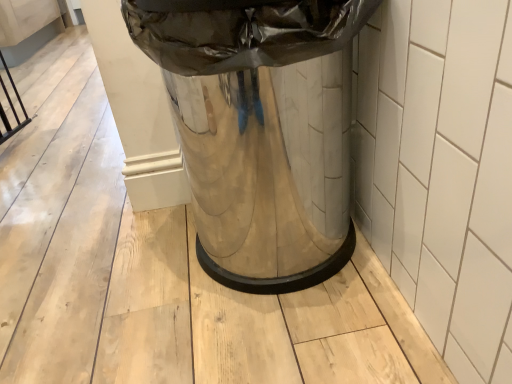
This screenshot has height=384, width=512. Find the location of `white glossy tile at right`. white glossy tile at right is located at coordinates (440, 170).

Describe the element at coordinates (440, 170) in the screenshot. This screenshot has height=384, width=512. I see `white glossy tile at right` at that location.

The height and width of the screenshot is (384, 512). Describe the element at coordinates (260, 130) in the screenshot. I see `polished metallic trash can at center` at that location.

This screenshot has height=384, width=512. In order to click on polished metallic trash can at center in this screenshot , I will do `click(260, 130)`.

Locate an element on the screen. white glossy tile at right is located at coordinates pos(440,170).

Is polished metallic trash can at center to the left of white glossy tile at right from the viewer's perspective?

Correct, you'll find polished metallic trash can at center to the left of white glossy tile at right.

Considering the positions of objects polished metallic trash can at center and white glossy tile at right in the image provided, who is in front, polished metallic trash can at center or white glossy tile at right?

white glossy tile at right.

Is point (231, 42) farther from camera compared to point (463, 245)?

Yes, it is.

From the image's perspective, is polished metallic trash can at center on top of white glossy tile at right?

Yes.

From a real-world perspective, is polished metallic trash can at center positioned above or below white glossy tile at right?

polished metallic trash can at center is above white glossy tile at right.

Considering the relative sizes of polished metallic trash can at center and white glossy tile at right in the image provided, is polished metallic trash can at center wider than white glossy tile at right?

Correct, the width of polished metallic trash can at center exceeds that of white glossy tile at right.

Who is taller, polished metallic trash can at center or white glossy tile at right?

Standing taller between the two is polished metallic trash can at center.

Who is bigger, polished metallic trash can at center or white glossy tile at right?

Bigger between the two is polished metallic trash can at center.

Would you say polished metallic trash can at center is inside or outside white glossy tile at right?

polished metallic trash can at center cannot be found inside white glossy tile at right.

Looking at this image, is polished metallic trash can at center not near white glossy tile at right?

polished metallic trash can at center is near white glossy tile at right, not far away.

Could you tell me if polished metallic trash can at center is facing white glossy tile at right?

No.

Can you tell me how much polished metallic trash can at center and white glossy tile at right differ in facing direction?

The angular difference between polished metallic trash can at center and white glossy tile at right is 89.5 degrees.

How distant is polished metallic trash can at center from white glossy tile at right?

polished metallic trash can at center and white glossy tile at right are 21.23 centimeters apart.

This screenshot has width=512, height=384. What are the coordinates of `waste container behind the white glossy tile at right` in the screenshot? It's located at (260, 130).

Between white glossy tile at right and polished metallic trash can at center, which one appears on the left side from the viewer's perspective?

Positioned to the left is polished metallic trash can at center.

Is white glossy tile at right further to camera compared to polished metallic trash can at center?

No, white glossy tile at right is closer to the camera.

Does point (443, 254) come behind point (279, 100)?

No.

From the image's perspective, would you say white glossy tile at right is shown under polished metallic trash can at center?

Correct, white glossy tile at right appears lower than polished metallic trash can at center in the image.

From a real-world perspective, which is physically below, white glossy tile at right or polished metallic trash can at center?

white glossy tile at right.

Which object is wider, white glossy tile at right or polished metallic trash can at center?

With larger width is polished metallic trash can at center.

Considering the sizes of objects white glossy tile at right and polished metallic trash can at center in the image provided, who is taller, white glossy tile at right or polished metallic trash can at center?

polished metallic trash can at center is taller.

Can you confirm if white glossy tile at right is smaller than polished metallic trash can at center?

Yes.

Is white glossy tile at right inside or outside of polished metallic trash can at center?

white glossy tile at right is not inside polished metallic trash can at center, it's outside.

Are white glossy tile at right and polished metallic trash can at center far apart?

No.

Is white glossy tile at right oriented away from polished metallic trash can at center?

Yes, white glossy tile at right is facing away from polished metallic trash can at center.

Consider the image. How distant is white glossy tile at right from polished metallic trash can at center?

white glossy tile at right is 8.36 inches from polished metallic trash can at center.

The height and width of the screenshot is (384, 512). I want to click on waste container that appears behind the white glossy tile at right, so click(x=260, y=130).

At what (x,y) coordinates should I click in order to perform the action: click on tile lying below the polished metallic trash can at center (from the image's perspective). Please return your answer as a coordinate pair (x, y). Looking at the image, I should click on (440, 170).

The image size is (512, 384). I want to click on waste container that is above the white glossy tile at right (from the image's perspective), so click(x=260, y=130).